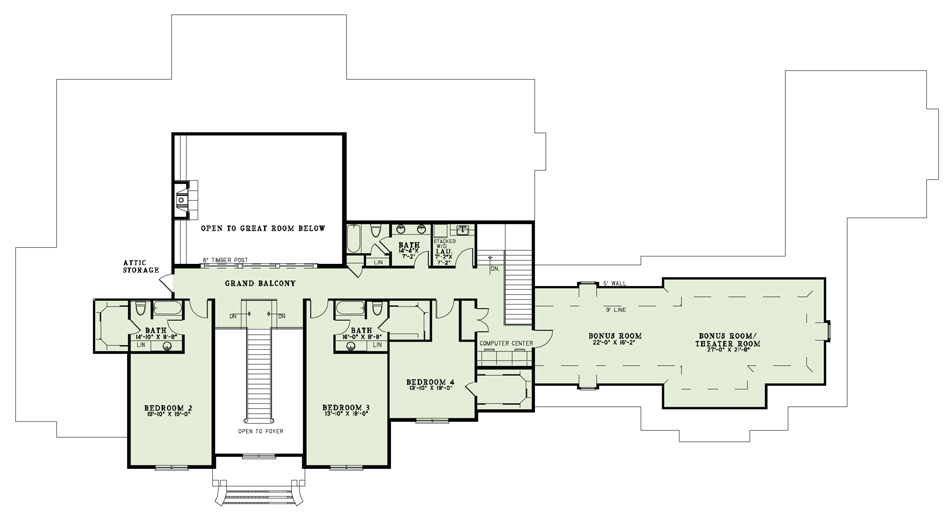
Identify the location of floor plan. (390, 286).